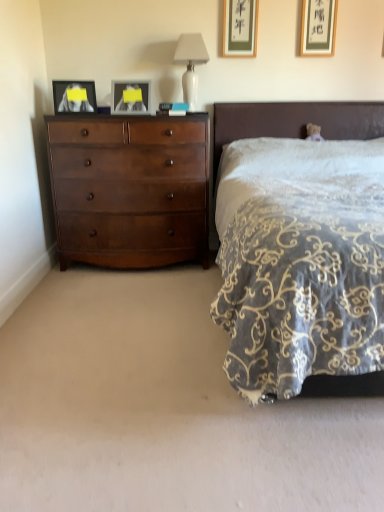
Question: Is matte glass picture frame at upper center, marked as the 2th picture frame in a left-to-right arrangement, not near matte black picture frame at left, marked as the 4th picture frame in a right-to-left arrangement?

Choices:
 (A) no
 (B) yes

Answer: (A)

Question: Is matte glass picture frame at upper center, marked as the 2th picture frame in a left-to-right arrangement, in contact with matte black picture frame at left, marked as the first picture frame in a left-to-right arrangement?

Choices:
 (A) yes
 (B) no

Answer: (B)

Question: Does matte glass picture frame at upper center, marked as the 2th picture frame in a left-to-right arrangement, come in front of matte black picture frame at left, marked as the first picture frame in a left-to-right arrangement?

Choices:
 (A) no
 (B) yes

Answer: (A)

Question: Can you confirm if matte glass picture frame at upper center, the third picture frame viewed from the right, is bigger than matte black picture frame at left, marked as the first picture frame in a left-to-right arrangement?

Choices:
 (A) yes
 (B) no

Answer: (A)

Question: From a real-world perspective, is matte glass picture frame at upper center, marked as the 2th picture frame in a left-to-right arrangement, on matte black picture frame at left, marked as the first picture frame in a left-to-right arrangement?

Choices:
 (A) yes
 (B) no

Answer: (A)

Question: Can you confirm if matte glass picture frame at upper center, marked as the 2th picture frame in a left-to-right arrangement, is smaller than matte black picture frame at left, marked as the 4th picture frame in a right-to-left arrangement?

Choices:
 (A) no
 (B) yes

Answer: (A)

Question: Is shiny brown dresser at left aimed at matte glass picture frame at upper center, marked as the 2th picture frame in a left-to-right arrangement?

Choices:
 (A) yes
 (B) no

Answer: (B)

Question: From a real-world perspective, is shiny brown dresser at left positioned under matte glass picture frame at upper center, the third picture frame viewed from the right, based on gravity?

Choices:
 (A) yes
 (B) no

Answer: (A)

Question: Considering the relative positions of shiny brown dresser at left and matte glass picture frame at upper center, marked as the 2th picture frame in a left-to-right arrangement, in the image provided, is shiny brown dresser at left behind matte glass picture frame at upper center, marked as the 2th picture frame in a left-to-right arrangement,?

Choices:
 (A) yes
 (B) no

Answer: (B)

Question: Can you confirm if shiny brown dresser at left is shorter than matte glass picture frame at upper center, the third picture frame viewed from the right?

Choices:
 (A) no
 (B) yes

Answer: (A)

Question: Can you see shiny brown dresser at left touching matte glass picture frame at upper center, marked as the 2th picture frame in a left-to-right arrangement?

Choices:
 (A) yes
 (B) no

Answer: (B)

Question: Can you confirm if shiny brown dresser at left is bigger than matte glass picture frame at upper center, marked as the 2th picture frame in a left-to-right arrangement?

Choices:
 (A) yes
 (B) no

Answer: (A)

Question: Is matte black picture frame at left, marked as the first picture frame in a left-to-right arrangement, at the left side of matte gold picture frame at upper right, which is the 4th picture frame in left-to-right order?

Choices:
 (A) no
 (B) yes

Answer: (B)